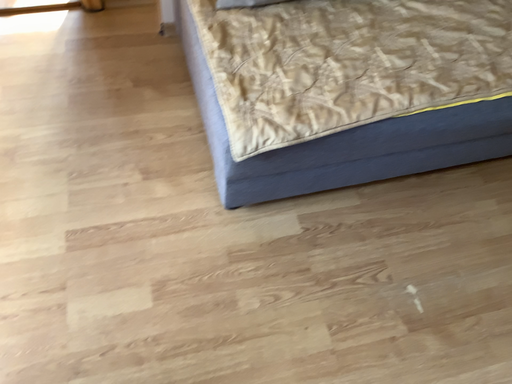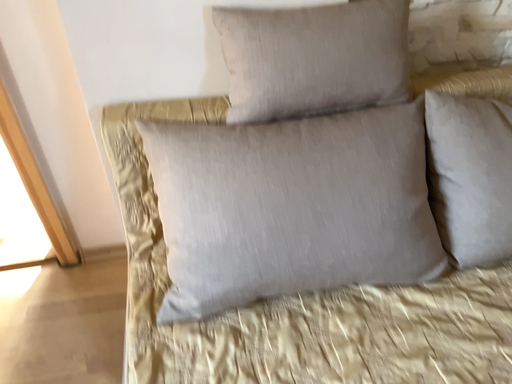
Question: How did the camera likely rotate when shooting the video?

Choices:
 (A) rotated downward
 (B) rotated upward

Answer: (B)